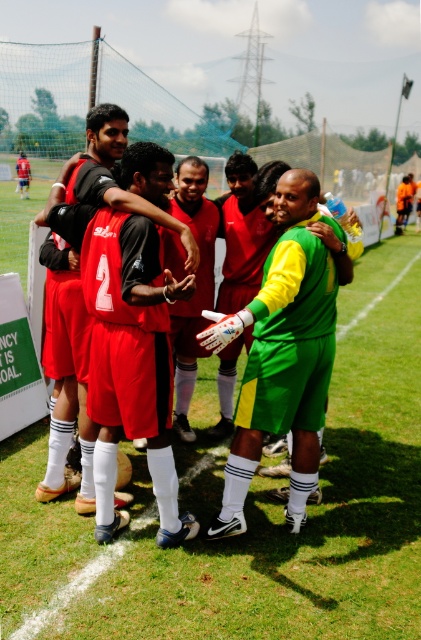
You are a photographer standing on the sidelines of the soccer field. You notice the matte red shorts at center and the green matte jersey at center in your viewfinder. Which object is positioned higher in the frame?

The matte red shorts at center is above the green matte jersey at center, so it is positioned higher in the frame.

You are a photographer standing at the origin point of the soccer field. You need to take a photo of the matte red shorts at center. According to the coordinates provided, where should you aim your camera?

The matte red shorts at center is located at coordinates point (127,355), so you should aim your camera towards that point to capture it.